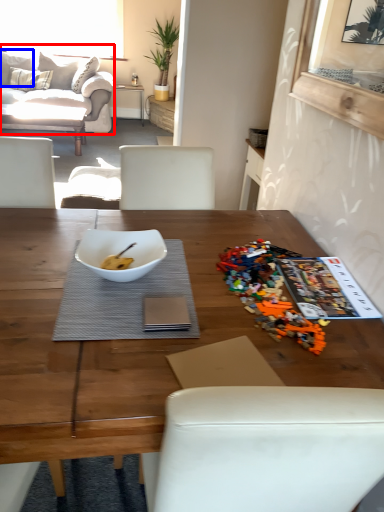
Question: Which point is closer to the camera, studio couch (highlighted by a red box) or pillow (highlighted by a blue box)?

Choices:
 (A) studio couch
 (B) pillow

Answer: (A)